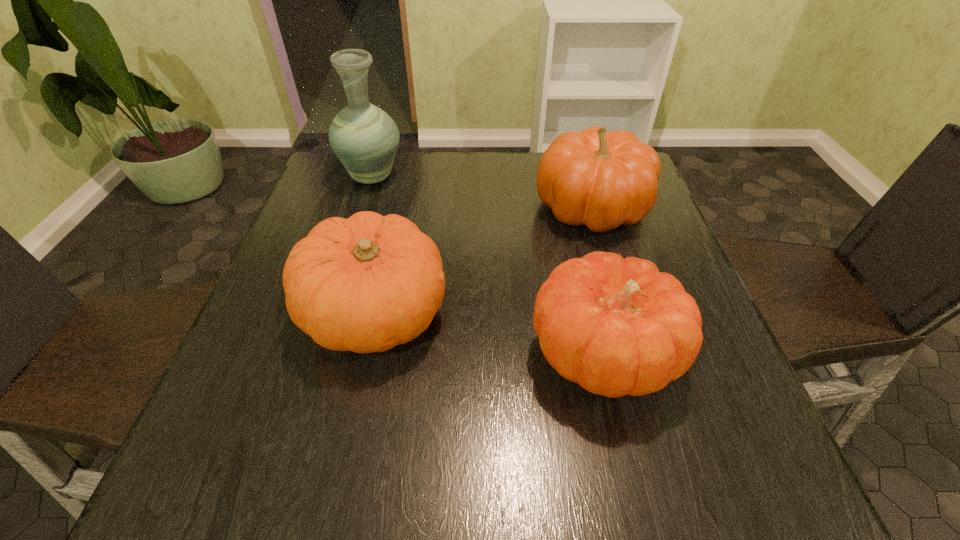
In order to click on object present at the far right corner in this screenshot , I will do `click(600, 179)`.

Identify the location of free location at the far edge of the desktop. The height and width of the screenshot is (540, 960). (450, 157).

In the image, there is a desktop. Identify the location of vacant region at the near edge. Image resolution: width=960 pixels, height=540 pixels. (341, 490).

You are a GUI agent. You are given a task and a screenshot of the screen. Output one action in this format:
    pyautogui.click(x=<x>, y=<y>)
    Task: Click on the free space at the left edge
    The image size is (960, 540).
    Given the screenshot: What is the action you would take?
    pyautogui.click(x=300, y=231)

This screenshot has height=540, width=960. What are the coordinates of `free spot at the near right corner of the desktop` in the screenshot? It's located at (715, 450).

This screenshot has width=960, height=540. Find the location of `free space between the pitcher and the farthest pumpkin`. free space between the pitcher and the farthest pumpkin is located at coordinates (482, 192).

Locate an element on the screen. The image size is (960, 540). unoccupied position between the leftmost pumpkin and the farthest pumpkin is located at coordinates (483, 260).

Where is `free space between the leftmost pumpkin and the farthest pumpkin`? Image resolution: width=960 pixels, height=540 pixels. free space between the leftmost pumpkin and the farthest pumpkin is located at coordinates (483, 260).

Choose which object is the nearest neighbor to the farthest pumpkin. Please provide its 2D coordinates. Your answer should be formatted as a tuple, i.e. [(x, y)], where the tuple contains the x and y coordinates of a point satisfying the conditions above.

[(617, 327)]

At what (x,y) coordinates should I click in order to perform the action: click on object that stands as the third closest to the farthest pumpkin. Please return your answer as a coordinate pair (x, y). Image resolution: width=960 pixels, height=540 pixels. Looking at the image, I should click on (365, 138).